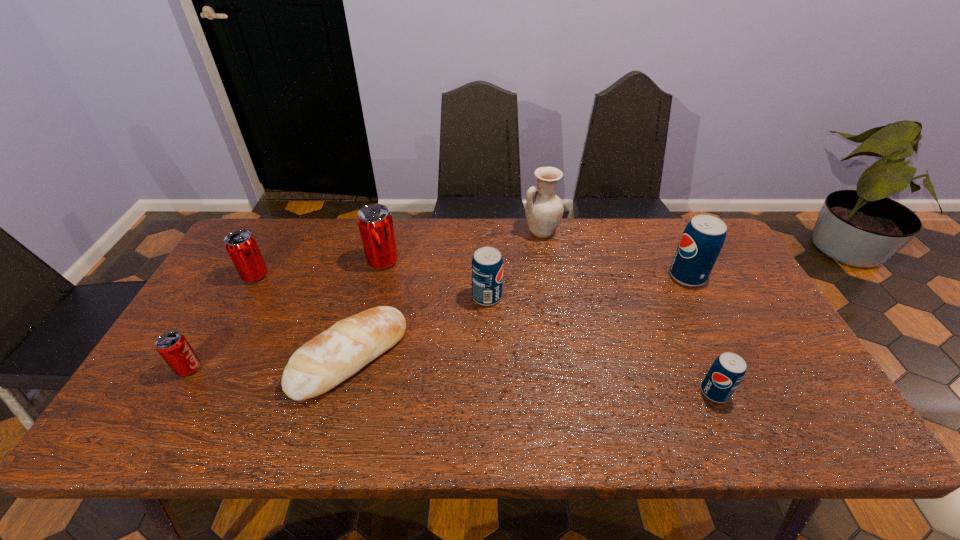
This screenshot has height=540, width=960. Find the location of `empty space that is in between the second biggest red soda can and the biggest red soda can`. empty space that is in between the second biggest red soda can and the biggest red soda can is located at coordinates (319, 268).

Where is `vacant area between the beige bread and the second biggest red soda can`? The height and width of the screenshot is (540, 960). vacant area between the beige bread and the second biggest red soda can is located at coordinates (302, 316).

Locate an element on the screen. free spot between the fourth pop from right to left and the fourth object from right to left is located at coordinates (435, 279).

Locate an element on the screen. The width and height of the screenshot is (960, 540). blank region between the biggest blue pop and the fourth pop from left to right is located at coordinates pos(587,287).

This screenshot has height=540, width=960. Identify the location of vacant space that's between the bread and the pink pottery. (445, 295).

The image size is (960, 540). Identify the location of free point between the beige bread and the biggest red soda can. (367, 309).

In order to click on vacant space that's between the bread and the biggest blue pop in this screenshot , I will do `click(518, 317)`.

Locate an element on the screen. free spot between the nearest blue pop and the biggest blue pop is located at coordinates (701, 334).

You are a GUI agent. You are given a task and a screenshot of the screen. Output one action in this format:
    pyautogui.click(x=<x>, y=<y>)
    Task: Click on the vacant area that lies between the smallest blue pop and the second biggest red soda can
    
    Given the screenshot: What is the action you would take?
    pyautogui.click(x=485, y=334)

I want to click on free space between the second smallest red soda can and the fourth object from right to left, so click(372, 286).